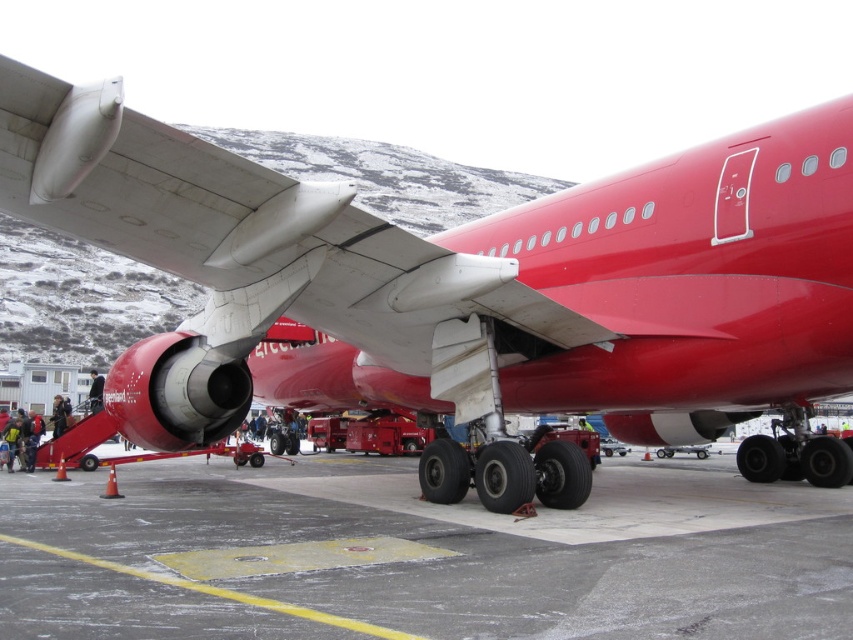
Question: Which point is closer to the camera?

Choices:
 (A) (200, 323)
 (B) (418, 609)

Answer: (B)

Question: From the image, what is the correct spatial relationship of matte red airplane at center in relation to gray asphalt at lower center?

Choices:
 (A) right
 (B) left

Answer: (A)

Question: Can you confirm if matte red airplane at center is positioned below gray asphalt at lower center?

Choices:
 (A) no
 (B) yes

Answer: (A)

Question: Among these objects, which one is nearest to the camera?

Choices:
 (A) matte red airplane at center
 (B) gray asphalt at lower center

Answer: (B)

Question: Is matte red airplane at center smaller than gray asphalt at lower center?

Choices:
 (A) yes
 (B) no

Answer: (A)

Question: Which point is closer to the camera?

Choices:
 (A) gray asphalt at lower center
 (B) matte red airplane at center

Answer: (A)